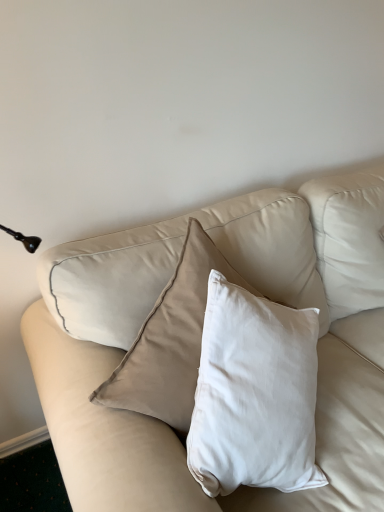
The width and height of the screenshot is (384, 512). I want to click on beige leather couch at center, so 262,293.

Describe the element at coordinates (262, 293) in the screenshot. The image size is (384, 512). I see `beige leather couch at center` at that location.

Where is `beige leather couch at center`? This screenshot has width=384, height=512. beige leather couch at center is located at coordinates coord(262,293).